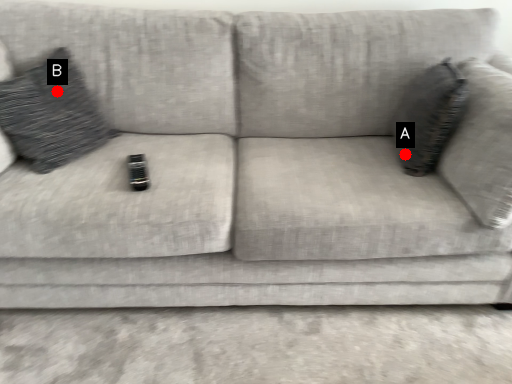
Question: Two points are circled on the image, labeled by A and B beside each circle. Which point is closer to the camera taking this photo?

Choices:
 (A) A is closer
 (B) B is closer

Answer: (B)